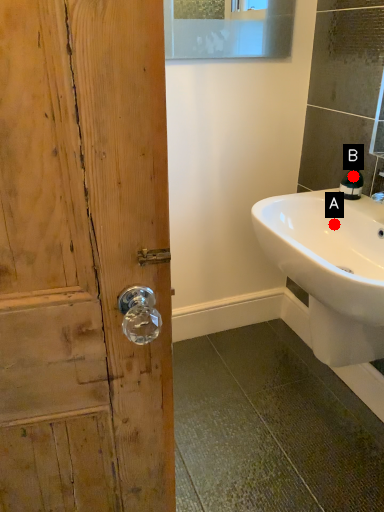
Question: Two points are circled on the image, labeled by A and B beside each circle. Which point appears farthest from the camera in this image?

Choices:
 (A) A is further
 (B) B is further

Answer: (B)